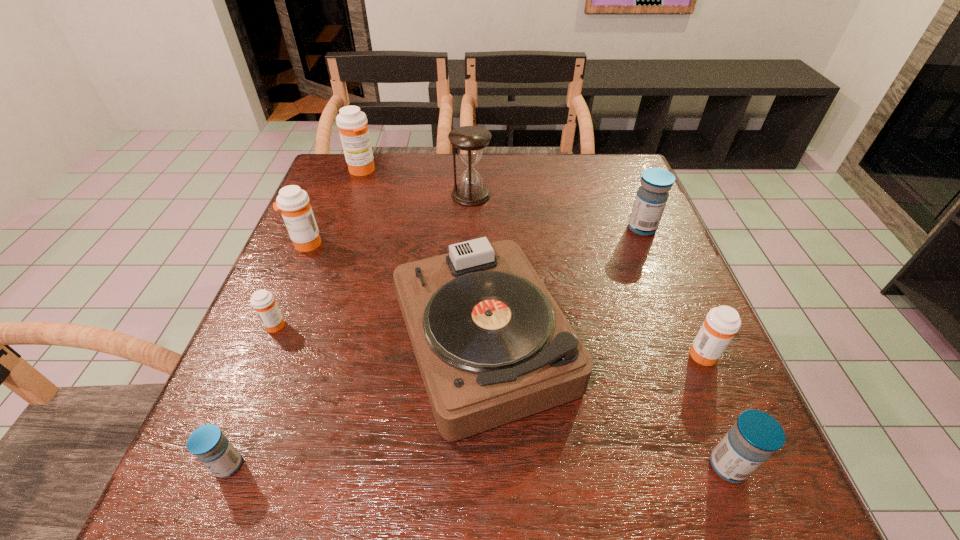
At what (x,y) coordinates should I click in order to perform the action: click on vacant space that satisfies the following two spatial constraints: 1. on the back side of the second smallest blue medicine; 2. on the right side of the fifth farthest medicine. Please return your answer as a coordinate pair (x, y). The width and height of the screenshot is (960, 540). Looking at the image, I should click on (684, 353).